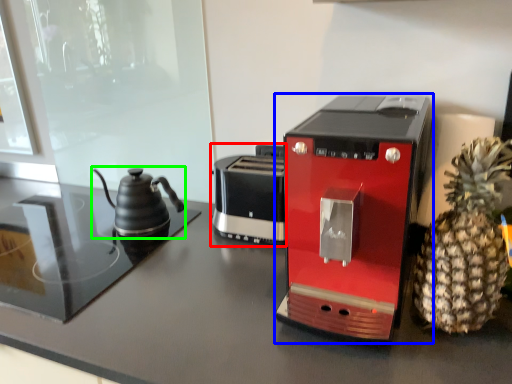
Question: Which is nearer to the toaster (highlighted by a red box)? coffee maker (highlighted by a blue box) or kettle (highlighted by a green box).

Choices:
 (A) coffee maker
 (B) kettle

Answer: (B)